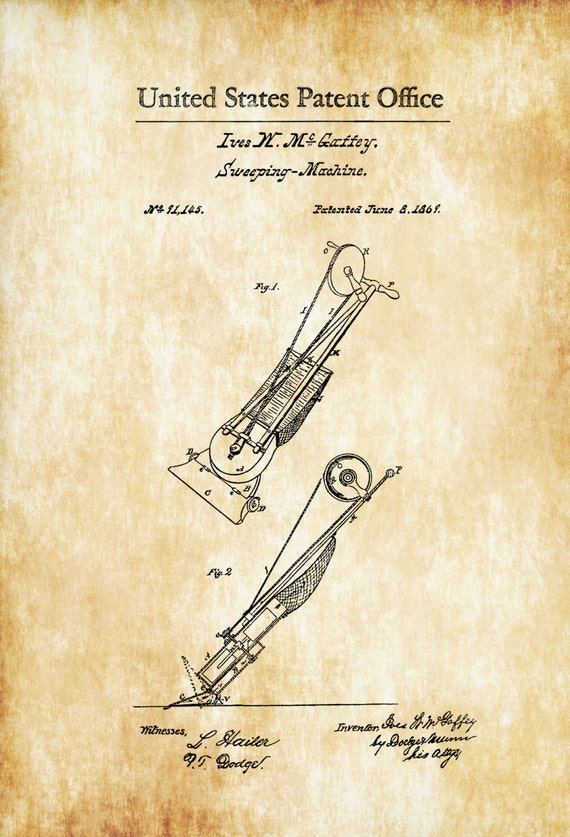
Identify the location of handle. (370, 283), (390, 471).